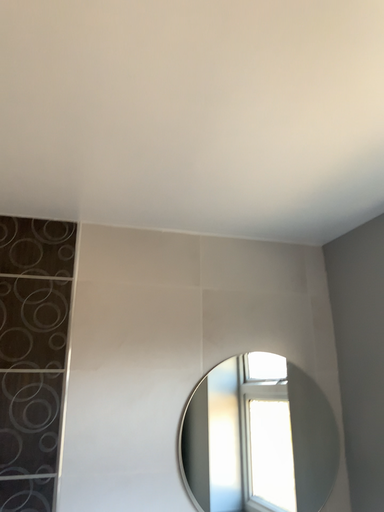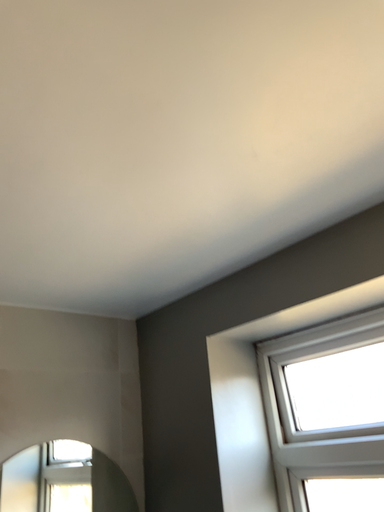
Question: Which way did the camera rotate in the video?

Choices:
 (A) rotated left
 (B) rotated right

Answer: (B)